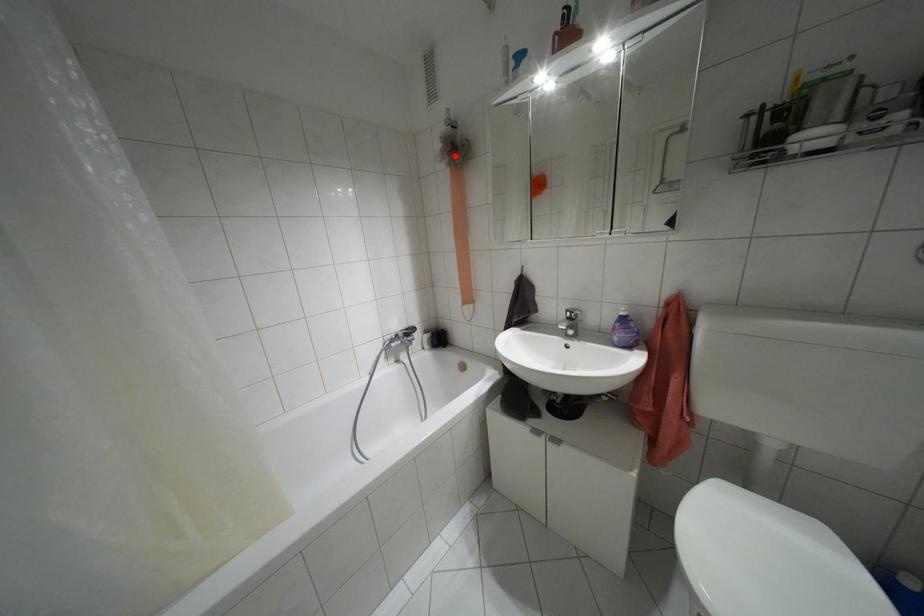
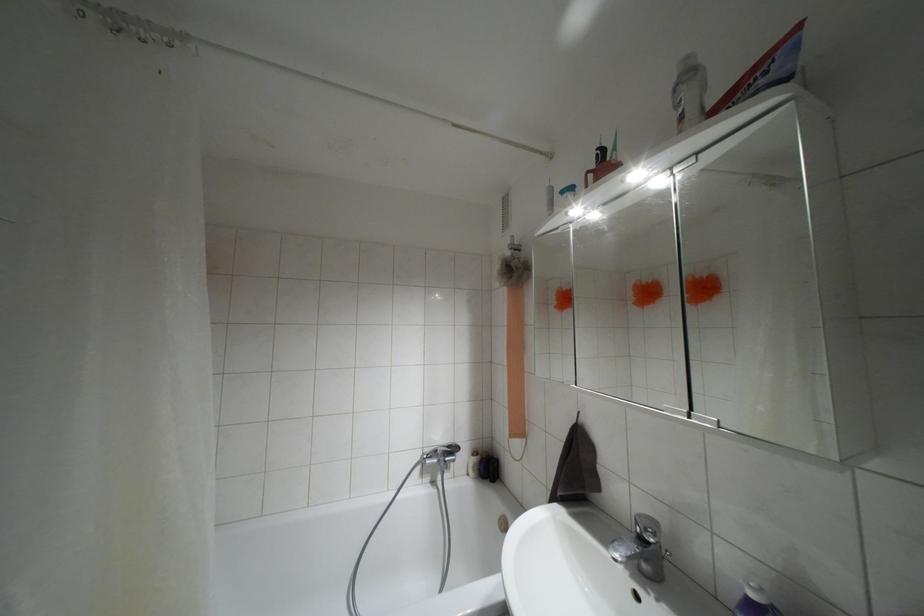
The point at the highlighted location is marked in the first image. Where is the corresponding point in the second image?

(509, 277)